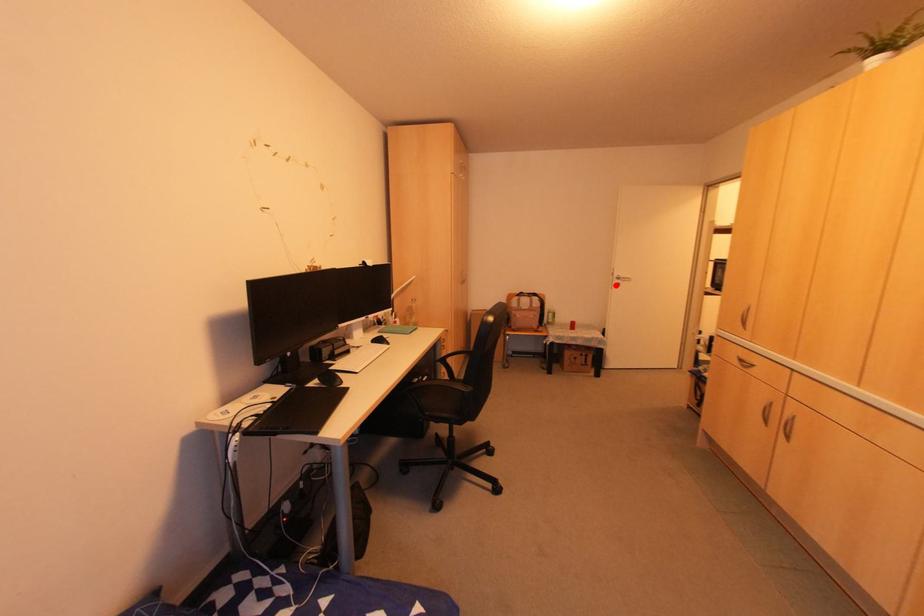
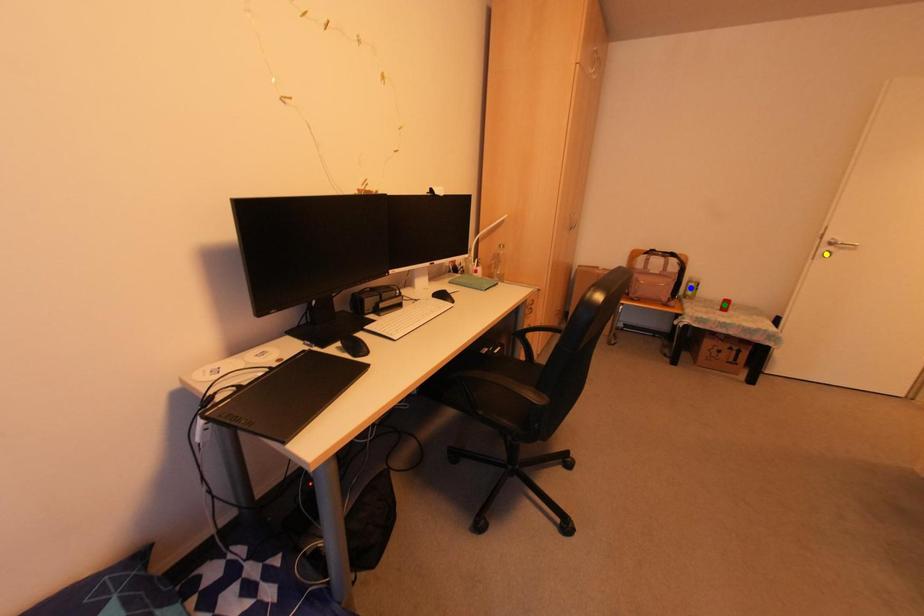
Question: I am providing you with two images of the same scene from different viewpoints. A red point is marked on the first image. You are given multiple points on the second image. In image 2, which mark is for the same physical point as the one in image 1?

Choices:
 (A) green point
 (B) blue point
 (C) yellow point

Answer: (C)